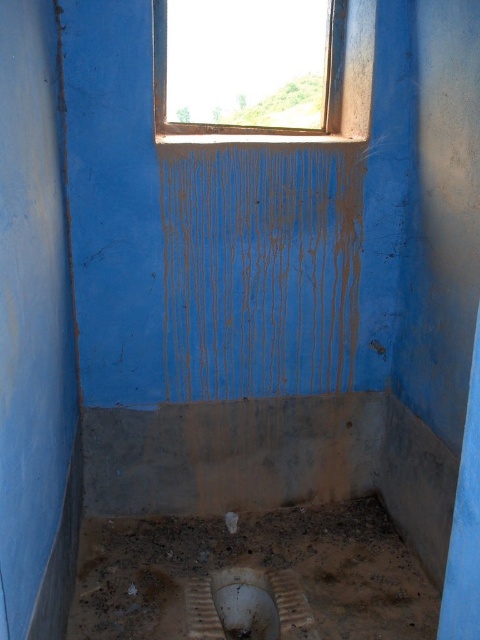
Question: Is metallic frame at upper center positioned before white matte toilet bowl at lower center?

Choices:
 (A) no
 (B) yes

Answer: (A)

Question: Is metallic frame at upper center to the left of white matte toilet bowl at lower center from the viewer's perspective?

Choices:
 (A) no
 (B) yes

Answer: (A)

Question: Which point appears farthest from the camera in this image?

Choices:
 (A) (171, 125)
 (B) (232, 588)

Answer: (A)

Question: Is metallic frame at upper center above white matte toilet bowl at lower center?

Choices:
 (A) no
 (B) yes

Answer: (B)